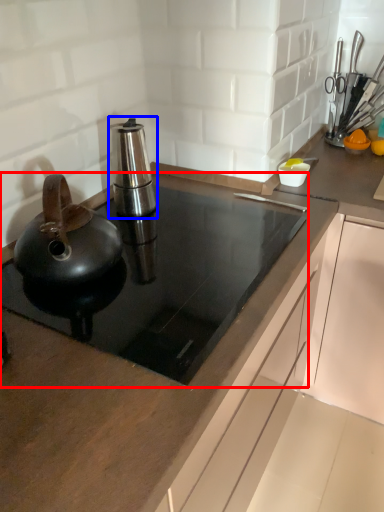
Question: Which point is further to the camera, gas stove (highlighted by a red box) or kitchen appliance (highlighted by a blue box)?

Choices:
 (A) gas stove
 (B) kitchen appliance

Answer: (B)